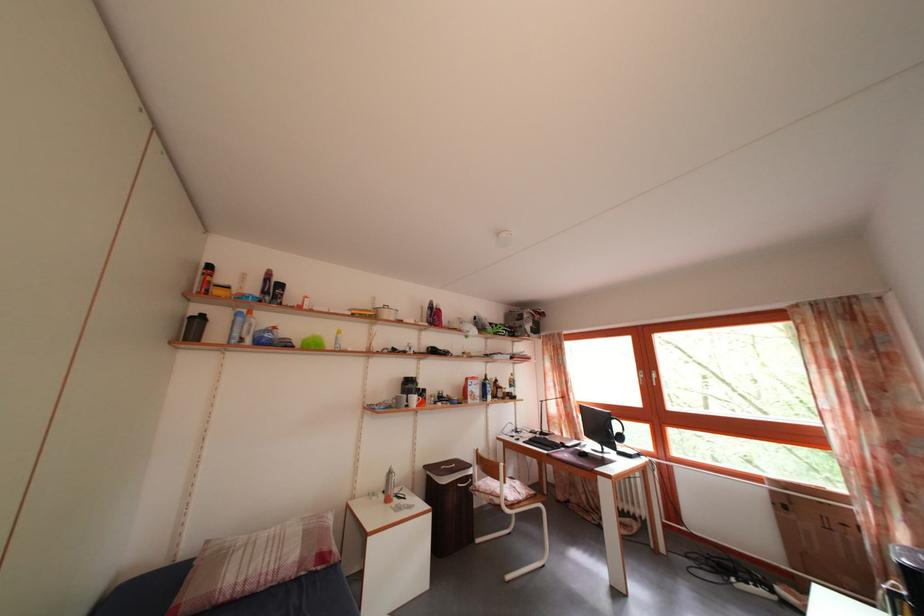
The image size is (924, 616). I want to click on sofa sitting surface, so click(150, 594).